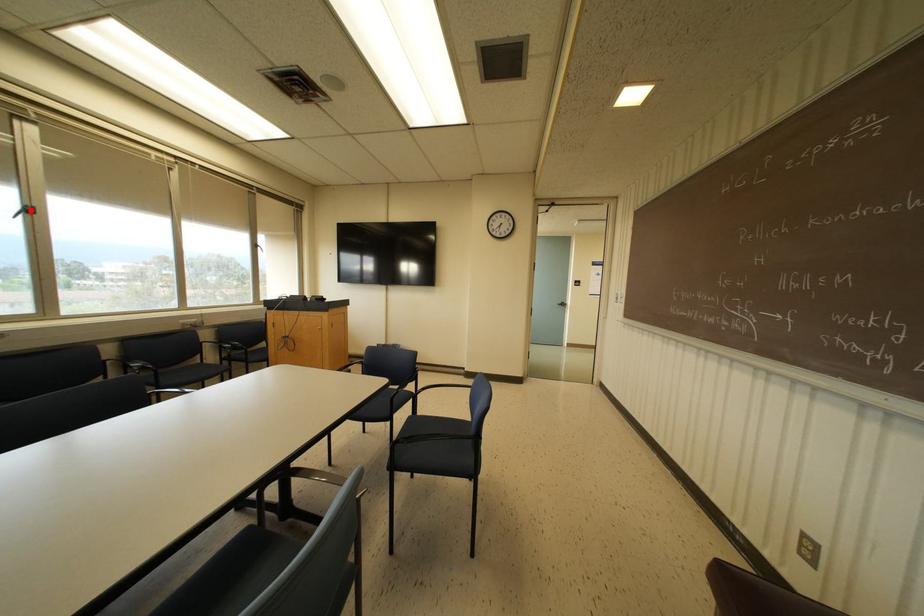
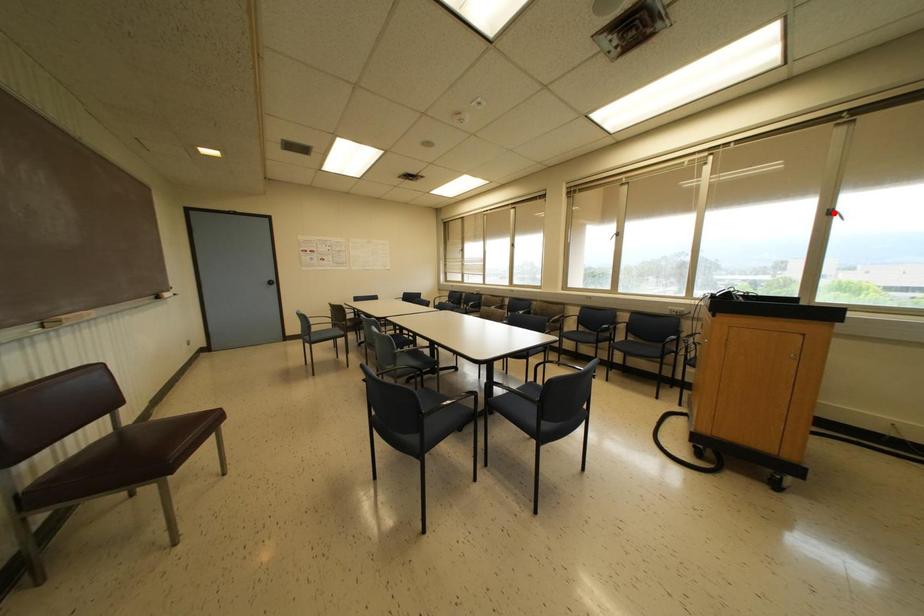
I am providing you with two images of the same scene from different viewpoints. A red point is marked on the first image and another point is marked on the second image. Is the marked point in image1 the same physical position as the marked point in image2?

No